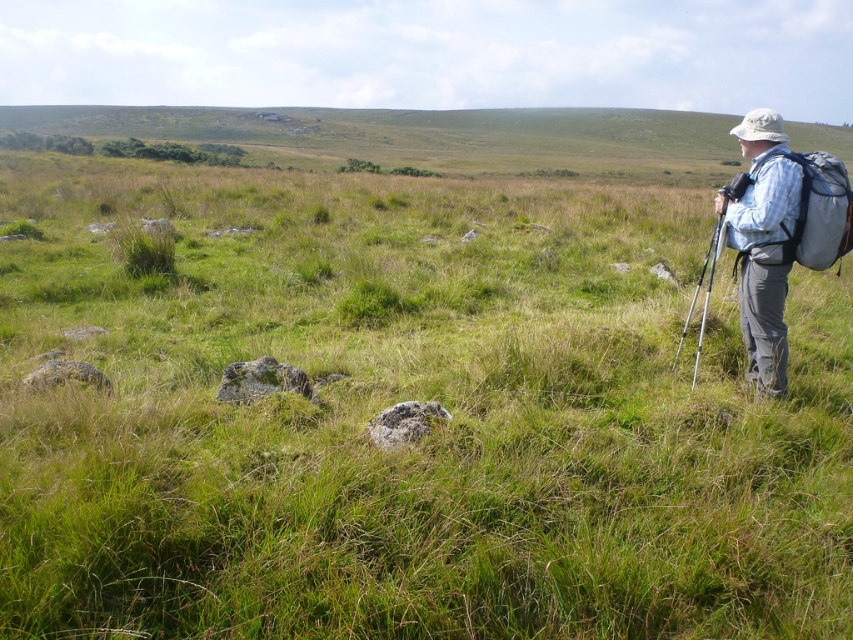
Is blue plaid shirt at right thinner than gray fabric backpack at right?

No, blue plaid shirt at right is not thinner than gray fabric backpack at right.

Does blue plaid shirt at right appear on the right side of gray fabric backpack at right?

Correct, you'll find blue plaid shirt at right to the right of gray fabric backpack at right.

Find the location of a particular element. blue plaid shirt at right is located at coordinates 763,243.